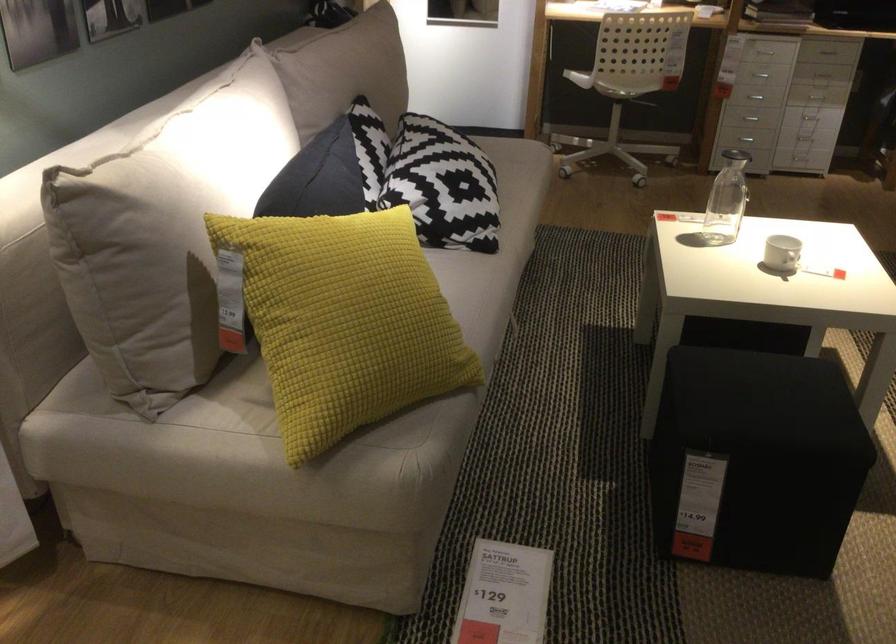
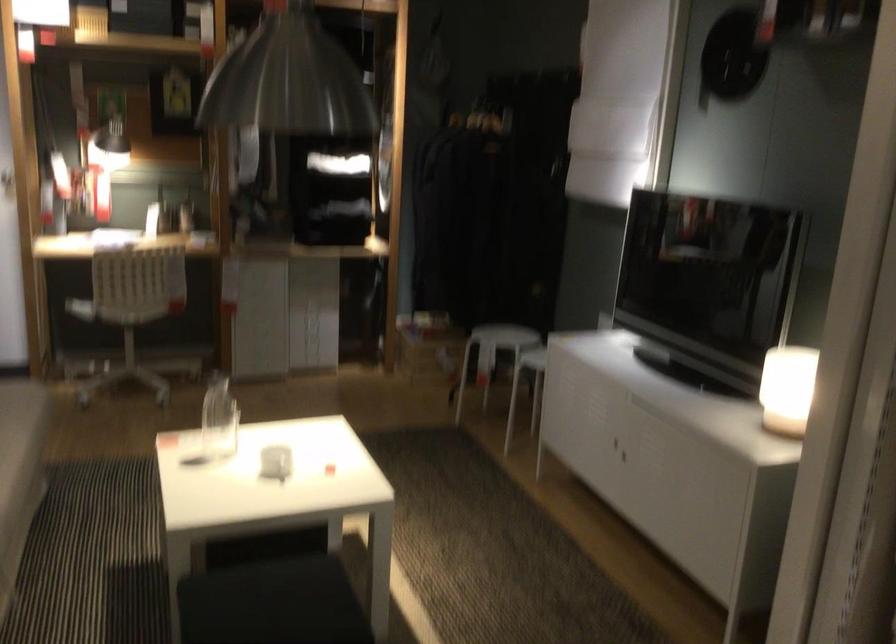
Find the pixel in the second image that matches point 582,73 in the first image.

(80, 308)